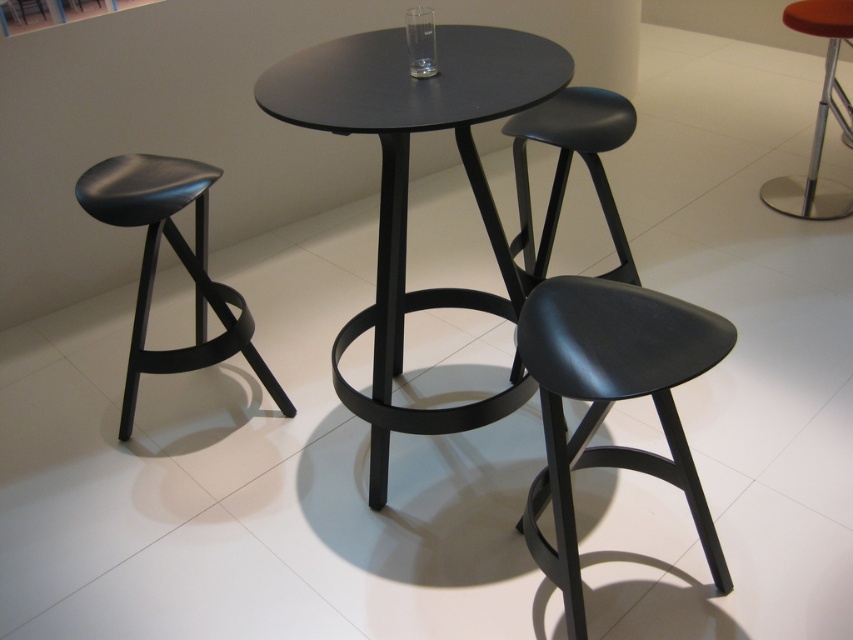
Question: Observing the image, what is the correct spatial positioning of black matte table at center in reference to orange leather bar stool at right?

Choices:
 (A) above
 (B) below

Answer: (B)

Question: Does black matte table at center appear over orange leather bar stool at right?

Choices:
 (A) no
 (B) yes

Answer: (A)

Question: Which point is farther to the camera?

Choices:
 (A) (630, 298)
 (B) (152, 360)
 (C) (387, 417)
 (D) (845, 22)

Answer: (D)

Question: Based on their relative distances, which object is farther from the black matte table at center?

Choices:
 (A) matte black stool at center
 (B) matte black stool at left
 (C) orange leather bar stool at right

Answer: (C)

Question: Estimate the real-world distances between objects in this image. Which object is farther from the orange leather bar stool at right?

Choices:
 (A) black matte table at center
 (B) matte black stool at center

Answer: (B)

Question: Is black matte table at center thinner than matte black stool at left?

Choices:
 (A) no
 (B) yes

Answer: (A)